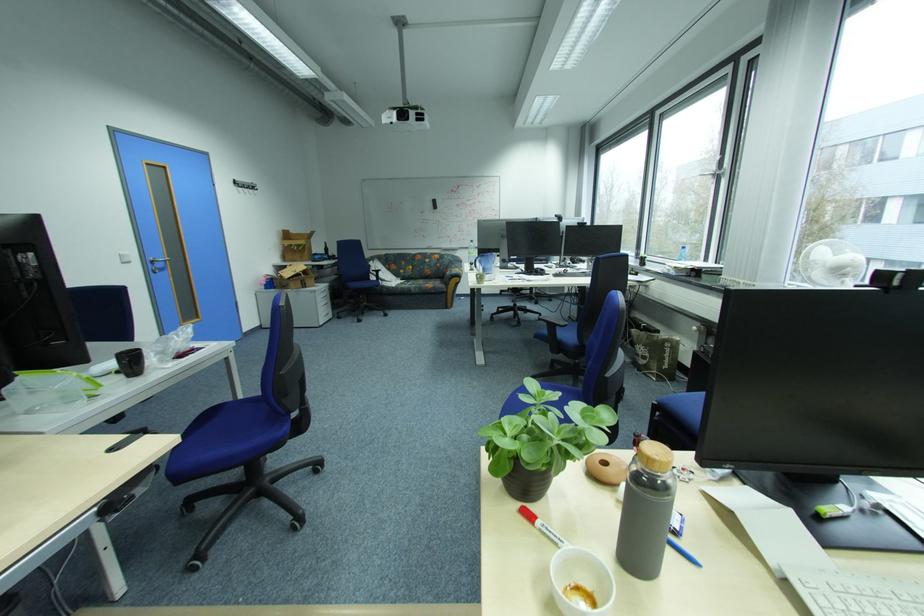
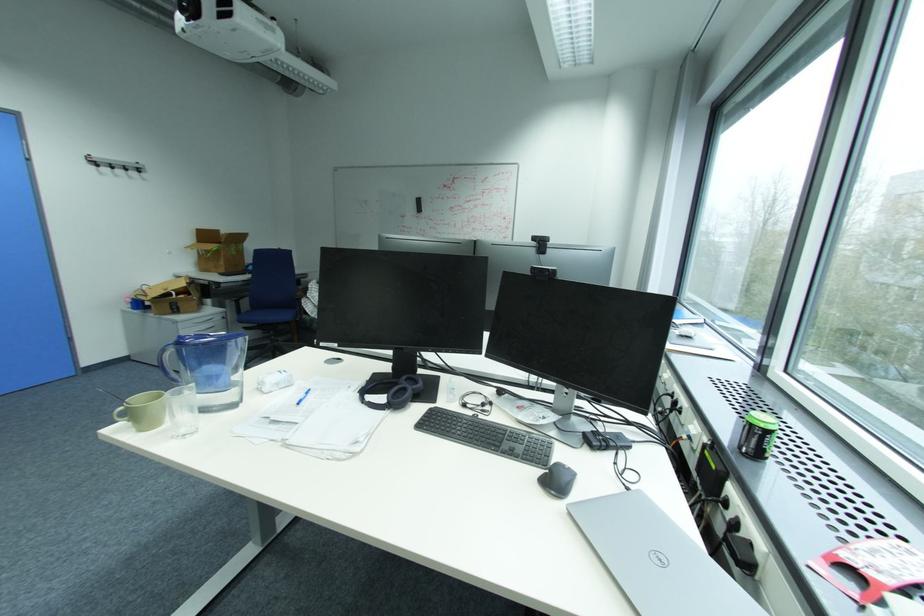
In a continuous first-person perspective shot, in which direction is the camera moving?

The cameraman moved toward right, forward.